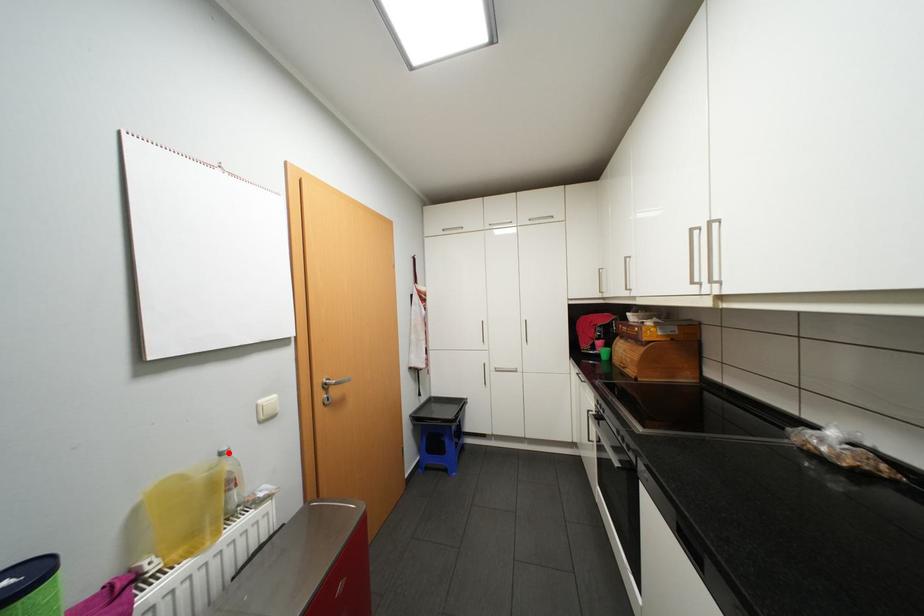
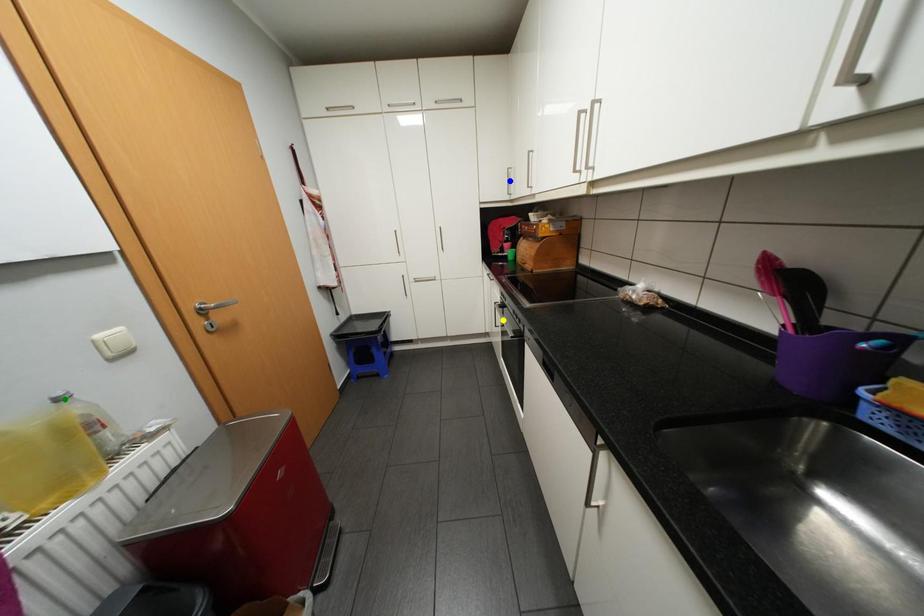
Question: I am providing you with two images of the same scene from different viewpoints. A red point is marked on the first image. You are given multiple points on the second image. Which spot in image 2 lines up with the point in image 1?

Choices:
 (A) green point
 (B) yellow point
 (C) blue point

Answer: (A)